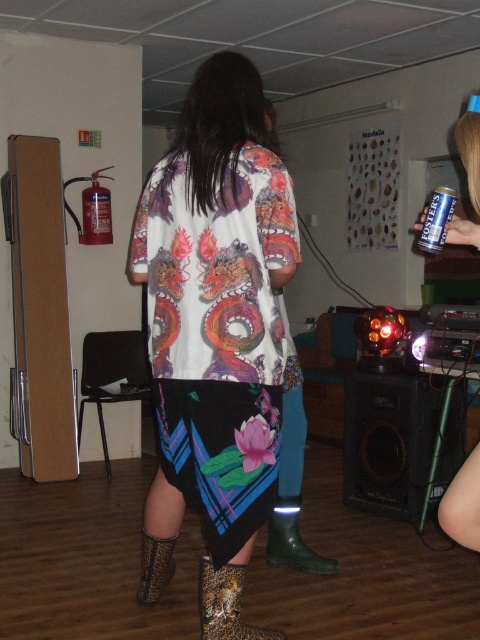
Is point (145, 580) more distant than point (434, 221)?

Yes, it is behind point (434, 221).

Is point (148, 566) positioned in front of point (440, 246)?

No, (148, 566) is further to viewer.

This screenshot has height=640, width=480. In order to click on leopard print boot at lower left in this screenshot , I will do `click(155, 566)`.

Who is higher up, leopard print fabric boot at lower center or green rubber boot at lower center?

green rubber boot at lower center is above.

Is leopard print fabric boot at lower center below green rubber boot at lower center?

Yes, leopard print fabric boot at lower center is below green rubber boot at lower center.

Where is `leopard print fabric boot at lower center`? This screenshot has height=640, width=480. leopard print fabric boot at lower center is located at coordinates (226, 604).

Is printed fabric dress at center taller than leopard print fabric boot at lower center?

Yes.

From the picture: Does printed fabric dress at center appear over leopard print fabric boot at lower center?

Indeed, printed fabric dress at center is positioned over leopard print fabric boot at lower center.

Identify the location of printed fabric dress at center. (216, 269).